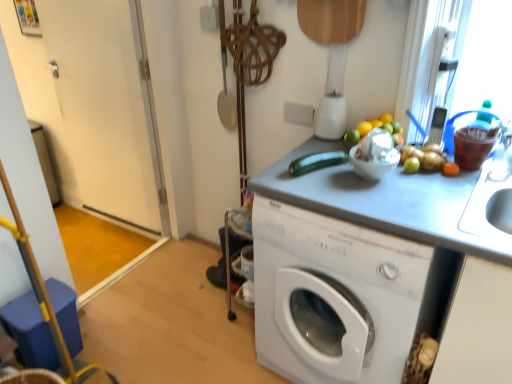
At what (x,y) coordinates should I click in order to perform the action: click on free space in front of green matte zucchini at center. Please return your answer as a coordinate pair (x, y). Image resolution: width=512 pixels, height=384 pixels. Looking at the image, I should click on (330, 190).